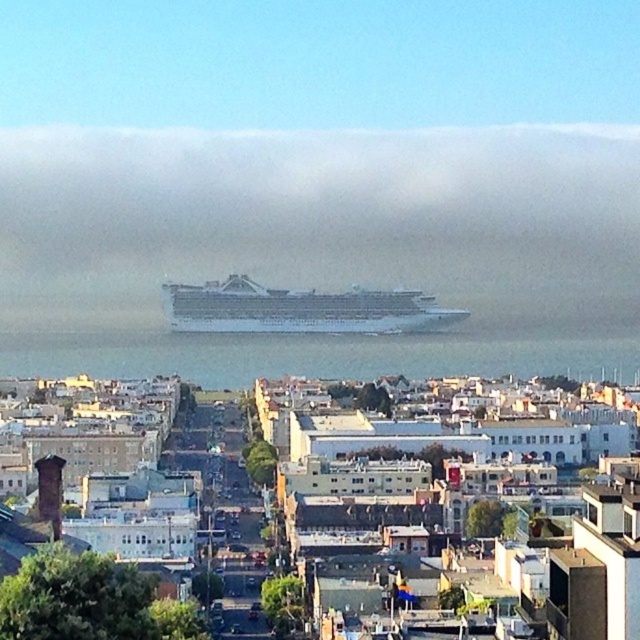
Question: Which object is closer to the camera taking this photo?

Choices:
 (A) white glossy cruise ship at center
 (B) white matte cruise ship at center

Answer: (A)

Question: Can you confirm if white matte cruise ship at center is wider than white glossy cruise ship at center?

Choices:
 (A) yes
 (B) no

Answer: (A)

Question: Is white matte cruise ship at center to the left of white glossy cruise ship at center from the viewer's perspective?

Choices:
 (A) no
 (B) yes

Answer: (A)

Question: Does white matte cruise ship at center appear on the right side of white glossy cruise ship at center?

Choices:
 (A) no
 (B) yes

Answer: (B)